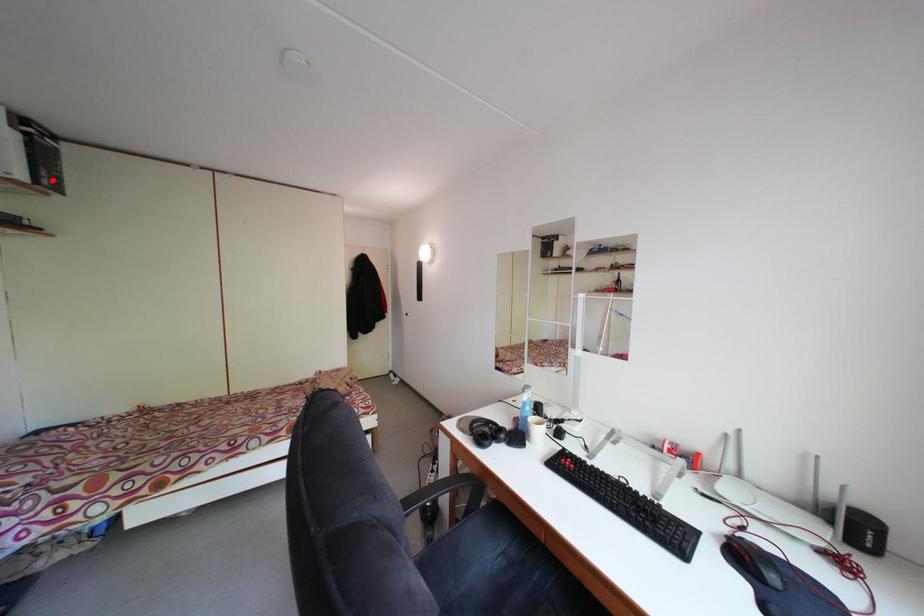
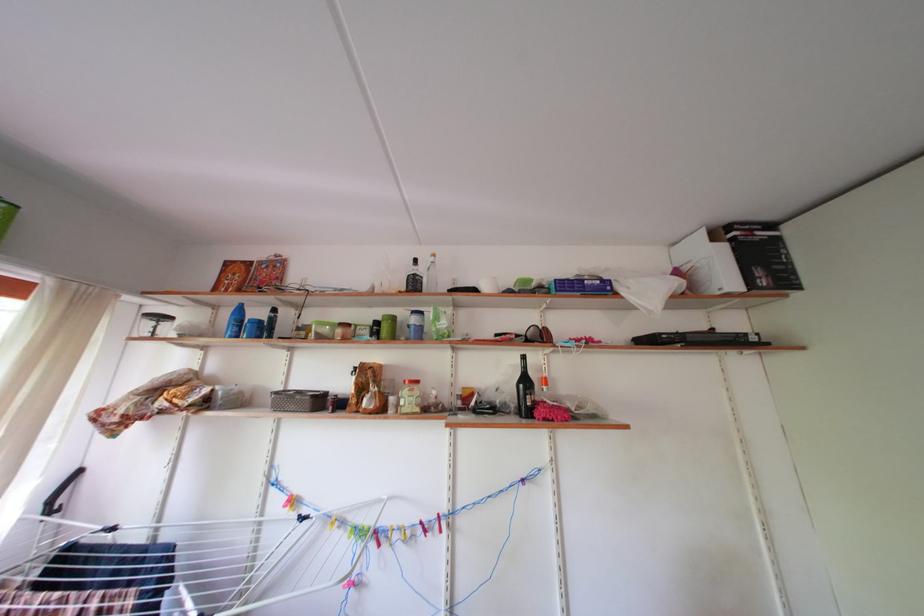
The point at the highlighted location is marked in the first image. Where is the corresponding point in the second image?

(768, 278)